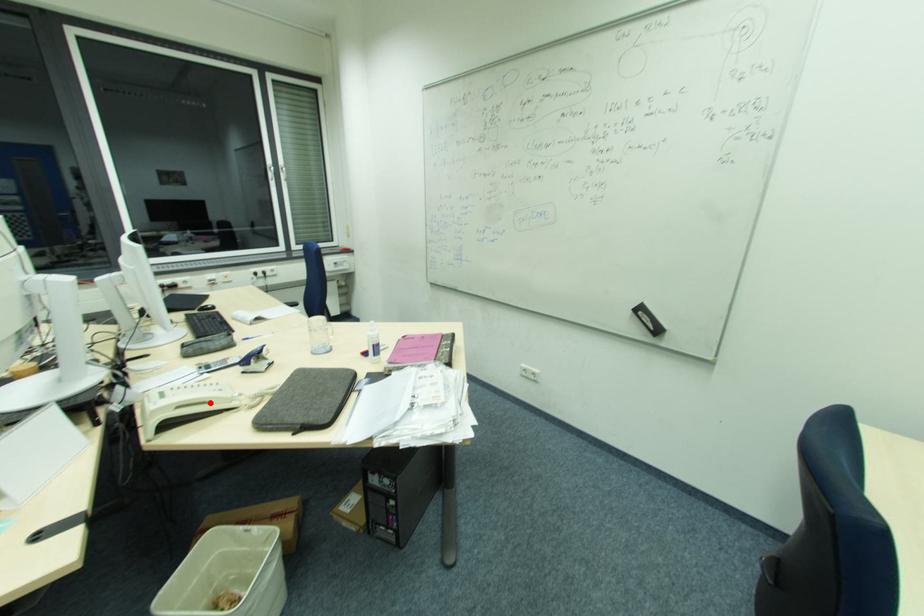
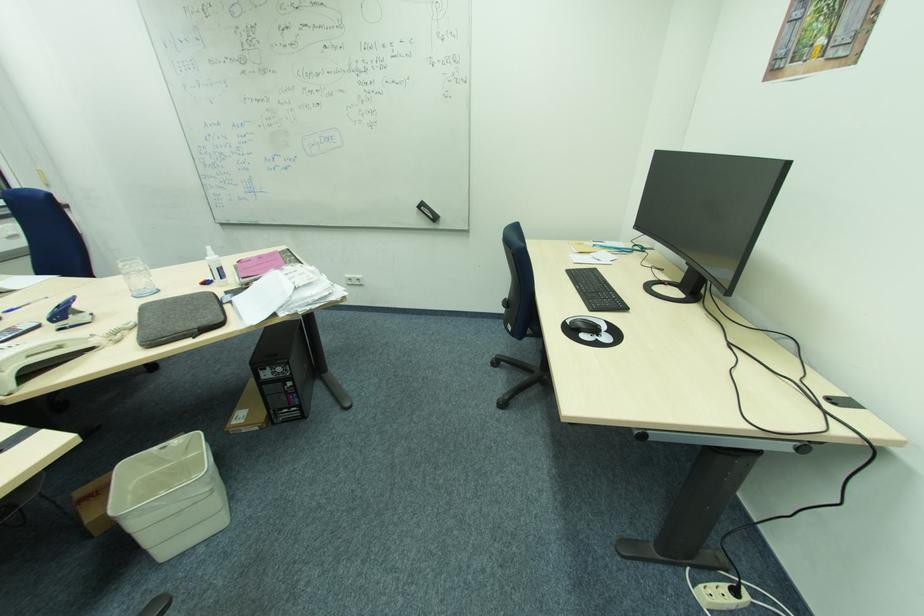
Where in the second image is the point corresponding to the highlighted location from the first image?

(64, 347)